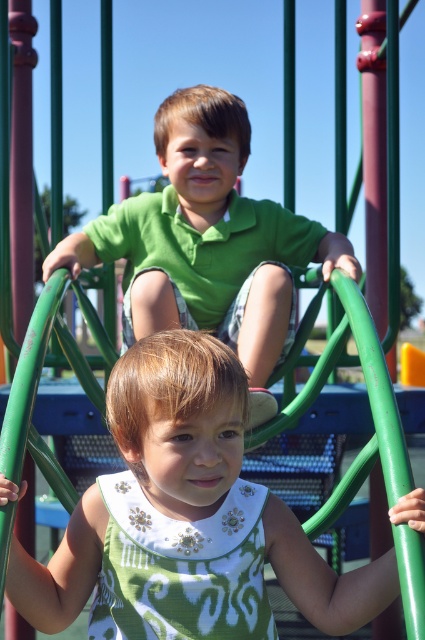
In the scene shown: You are a photographer standing at the center of the playground. You want to take a photo of the green fabric dress at center. Which direction should you move to get a better shot?

The green fabric dress at center is located at point (178, 420), so you should move towards the coordinates to frame it properly.

You are a photographer trying to capture both the green fabric dress at center and the green matte shirt at upper center in a single shot. Which one will appear larger in the photo?

The green fabric dress at center will appear larger in the photo because it is closer to the viewer than the green matte shirt at upper center.